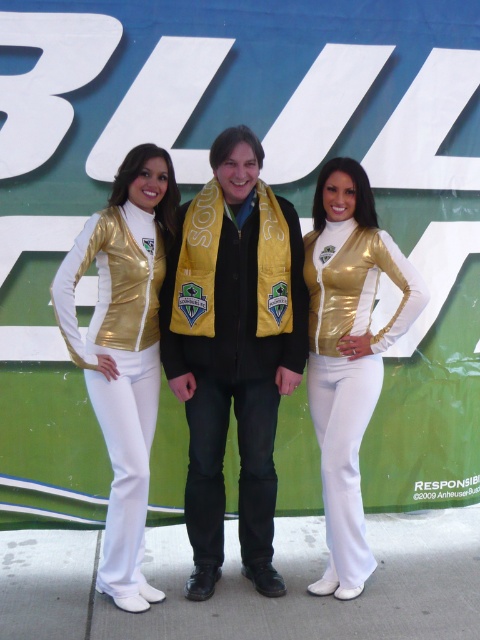
Question: Estimate the real-world distances between objects in this image. Which object is closer to the shiny gold jacket at center?

Choices:
 (A) metallic gold vest at center
 (B) shiny yellow scarf at center

Answer: (B)

Question: From the image, what is the correct spatial relationship of metallic gold vest at center in relation to shiny gold jacket at center?

Choices:
 (A) above
 (B) below

Answer: (A)

Question: Which point is farther from the camera taking this photo?

Choices:
 (A) (368, 234)
 (B) (250, 561)

Answer: (B)

Question: Is shiny yellow scarf at center smaller than shiny gold jacket at center?

Choices:
 (A) yes
 (B) no

Answer: (B)

Question: Can you confirm if metallic gold vest at center is smaller than shiny gold jacket at center?

Choices:
 (A) no
 (B) yes

Answer: (A)

Question: Among these points, which one is nearest to the camera?

Choices:
 (A) (351, 384)
 (B) (80, 232)
 (C) (272, 260)

Answer: (C)